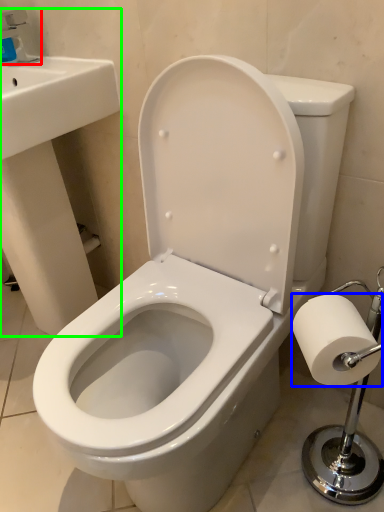
Question: Estimate the real-world distances between objects in this image. Which object is closer to faucet (highlighted by a red box), toilet paper (highlighted by a blue box) or sink (highlighted by a green box)?

Choices:
 (A) toilet paper
 (B) sink

Answer: (B)